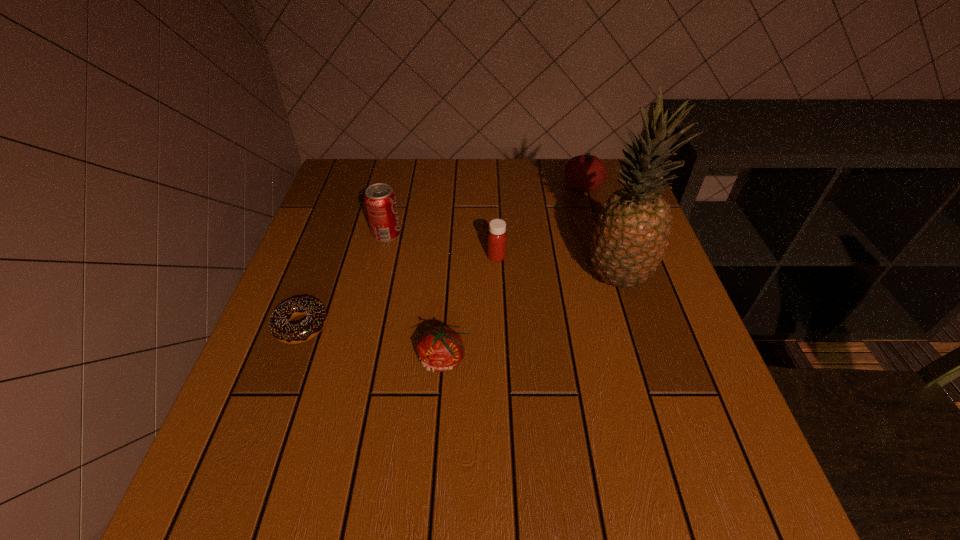
Where is `blank space located 0.250m on the back of the tallest object`? blank space located 0.250m on the back of the tallest object is located at coordinates (591, 195).

Find the location of a particular element. vacant space located 0.390m on the front of the second tallest object is located at coordinates (352, 380).

Find the location of a particular element. free space located 0.330m on the left of the farther tomato is located at coordinates (447, 187).

Locate an element on the screen. vacant space situated 0.330m on the right of the medicine is located at coordinates (643, 257).

Find the location of a particular element. The height and width of the screenshot is (540, 960). vacant space located 0.110m on the back of the left tomato is located at coordinates (448, 299).

Find the location of a particular element. The width and height of the screenshot is (960, 540). vacant space situated on the front of the shortest object is located at coordinates (228, 528).

Where is `object that is at the far edge`? The image size is (960, 540). object that is at the far edge is located at coordinates (587, 172).

Identify the location of soda can at the left edge. The image size is (960, 540). (380, 200).

Where is `doughnut that is at the left edge`? The width and height of the screenshot is (960, 540). doughnut that is at the left edge is located at coordinates (279, 323).

Where is `pineapple that is at the right edge`? This screenshot has height=540, width=960. pineapple that is at the right edge is located at coordinates (628, 243).